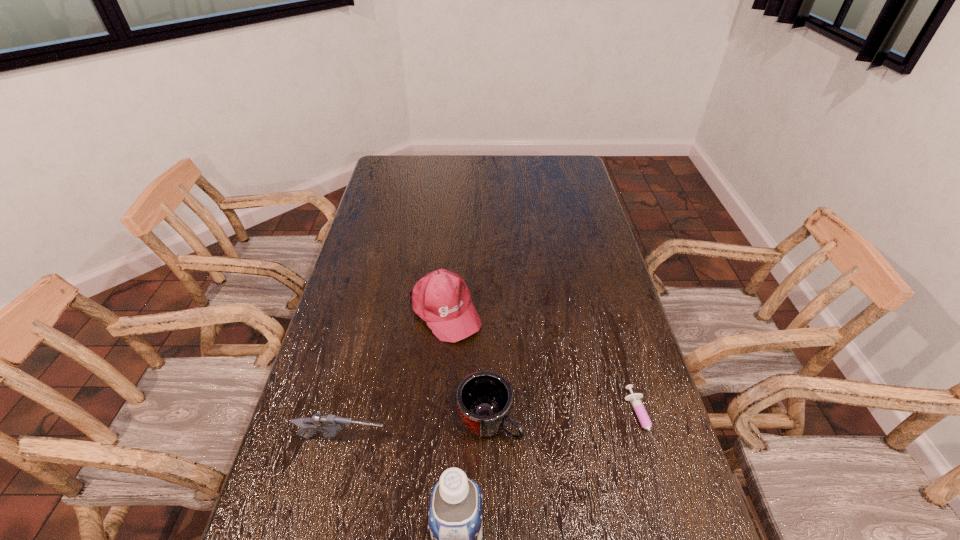
In order to click on free space at the far left corner in this screenshot , I will do `click(384, 154)`.

This screenshot has height=540, width=960. Find the location of `vacant space at the far right corner of the desktop`. vacant space at the far right corner of the desktop is located at coordinates click(x=565, y=168).

This screenshot has width=960, height=540. I want to click on empty space that is in between the syringe and the mug, so click(x=564, y=421).

Locate an element on the screen. vacant space in between the rightmost object and the farthest object is located at coordinates (541, 367).

Locate an element on the screen. Image resolution: width=960 pixels, height=540 pixels. vacant area between the syringe and the mug is located at coordinates (564, 421).

Point out which object is positioned as the nearest to the syringe. Please provide its 2D coordinates. Your answer should be formatted as a tuple, i.e. [(x, y)], where the tuple contains the x and y coordinates of a point satisfying the conditions above.

[(484, 399)]

The width and height of the screenshot is (960, 540). I want to click on object that ranks as the second closest to the shortest object, so click(x=455, y=505).

In order to click on vacant space that satisfies the following two spatial constraints: 1. on the back side of the gun; 2. on the right side of the shortest object in this screenshot , I will do `click(348, 422)`.

At what (x,y) coordinates should I click in order to perform the action: click on free region that satisfies the following two spatial constraints: 1. on the front side of the rightmost object; 2. on the right side of the mug. Please return your answer as a coordinate pair (x, y). This screenshot has width=960, height=540. Looking at the image, I should click on tap(489, 422).

Find the location of `free space that satisfies the following two spatial constraints: 1. on the front side of the shortest object; 2. on the right side of the baseball cap`. free space that satisfies the following two spatial constraints: 1. on the front side of the shortest object; 2. on the right side of the baseball cap is located at coordinates (436, 422).